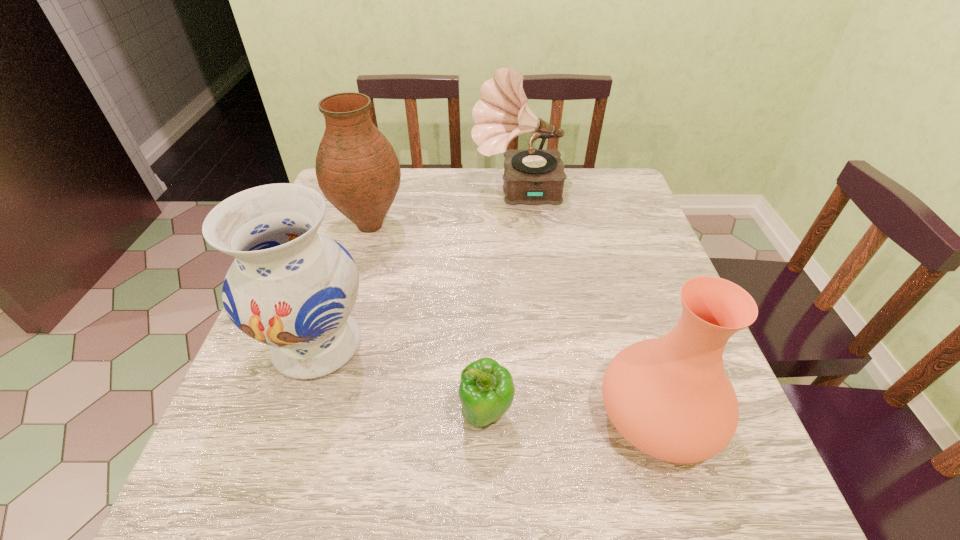
Identify which object is the second closest to the farthest vase. Please provide its 2D coordinates. Your answer should be formatted as a tuple, i.e. [(x, y)], where the tuple contains the x and y coordinates of a point satisfying the conditions above.

[(290, 287)]

Point out which vase is positioned as the second nearest to the record player. Please provide its 2D coordinates. Your answer should be formatted as a tuple, i.e. [(x, y)], where the tuple contains the x and y coordinates of a point satisfying the conditions above.

[(290, 287)]

Point out which vase is positioned as the second nearest to the farthest vase. Please provide its 2D coordinates. Your answer should be formatted as a tuple, i.e. [(x, y)], where the tuple contains the x and y coordinates of a point satisfying the conditions above.

[(670, 397)]

Locate an element on the screen. vacant space that satisfies the following two spatial constraints: 1. from the horn of the rightmost vase; 2. on the left side of the record player is located at coordinates (541, 417).

The height and width of the screenshot is (540, 960). I want to click on free space that satisfies the following two spatial constraints: 1. from the horn of the record player; 2. on the left side of the rightmost vase, so click(x=541, y=417).